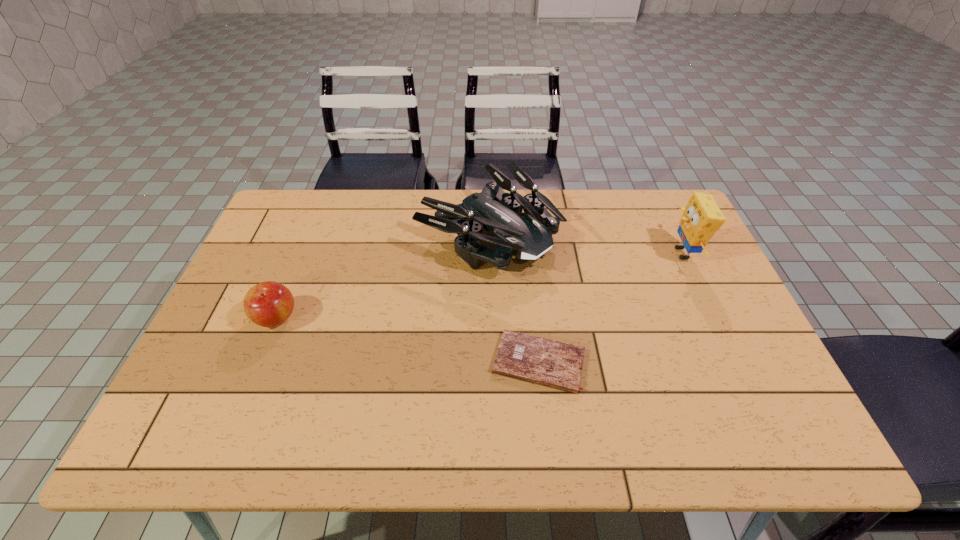
The image size is (960, 540). I want to click on vacant region located on the back of the third tallest object, so click(289, 287).

Where is `vacant space positioned 0.110m on the left of the shortest object`? This screenshot has width=960, height=540. vacant space positioned 0.110m on the left of the shortest object is located at coordinates (445, 362).

Locate an element on the screen. sponge situated at the far edge is located at coordinates (701, 218).

The height and width of the screenshot is (540, 960). In order to click on drone that is positioned at the far edge in this screenshot , I will do `click(528, 236)`.

Locate an element on the screen. This screenshot has height=540, width=960. object at the left edge is located at coordinates (267, 304).

Locate an element on the screen. This screenshot has height=540, width=960. object that is positioned at the right edge is located at coordinates (701, 218).

Locate an element on the screen. The width and height of the screenshot is (960, 540). object present at the far right corner is located at coordinates (701, 218).

This screenshot has width=960, height=540. I want to click on free space at the far edge of the desktop, so point(420,208).

This screenshot has height=540, width=960. In the image, there is a desktop. What are the coordinates of `blank space at the near edge` in the screenshot? It's located at (472, 414).

In the image, there is a desktop. Where is `blank space at the left edge`? blank space at the left edge is located at coordinates click(237, 322).